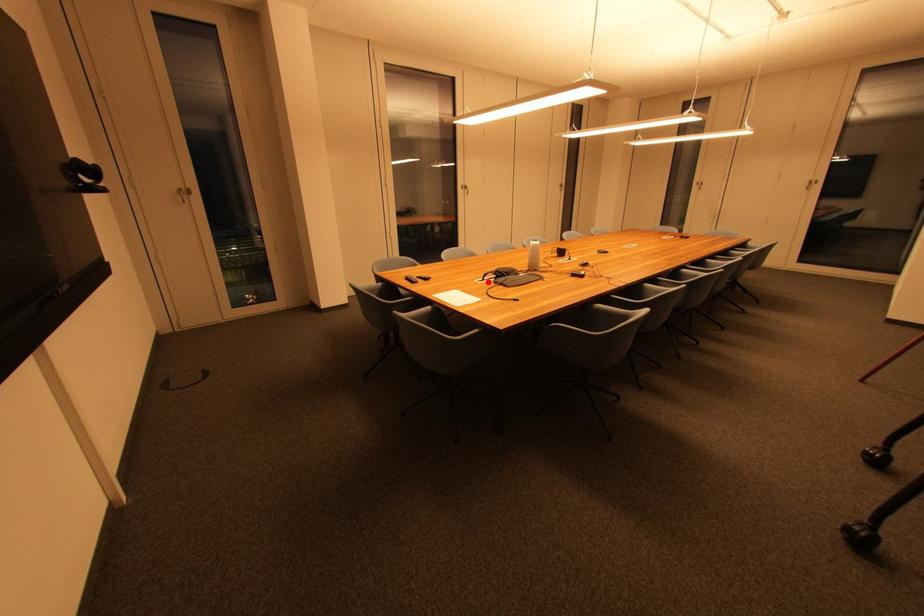
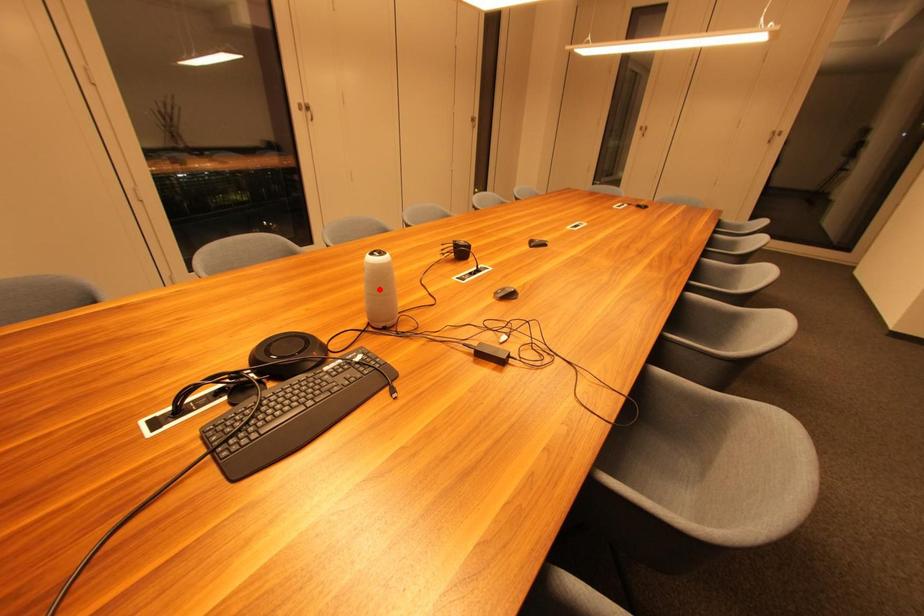
I am providing you with two images of the same scene from different viewpoints. A red point is marked on the first image and another point is marked on the second image. Is the red point in image1 aligned with the point shown in image2?

No